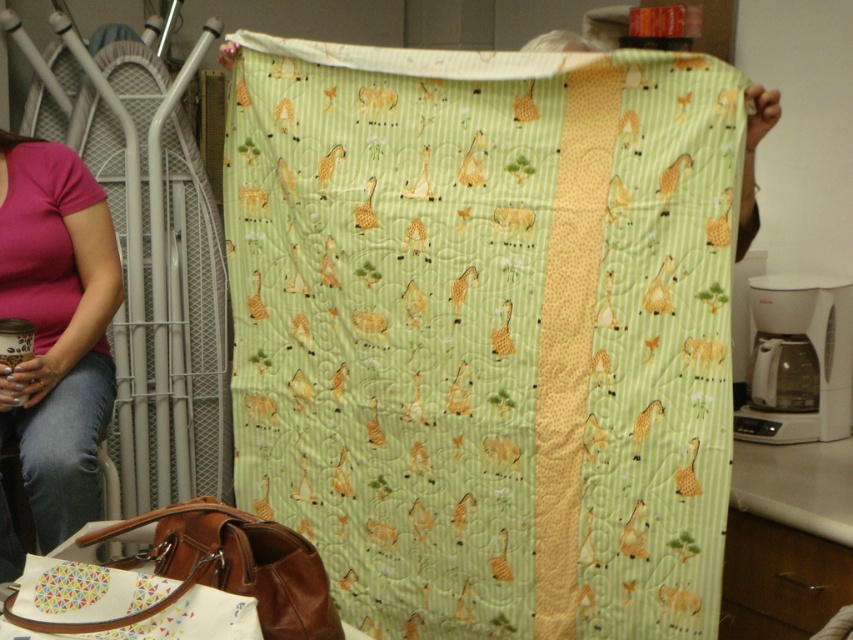
You are standing in front of the quilt and want to determine which of the two points, point (706, 492) or point (312, 577), is closer to you. Based on the quilt details, which point is nearer?

Point (706, 492) is closer to you because it is further to the viewer than point (312, 577).

You are organizing a craft fair and need to display both the green quilted fabric at center and the brown leather bag at lower left. Since you have limited space, which item should you prioritize placing first to accommodate both?

The green quilted fabric at center is bigger than the brown leather bag at lower left, so you should prioritize placing the green quilted fabric at center first to ensure there is enough space for both items.